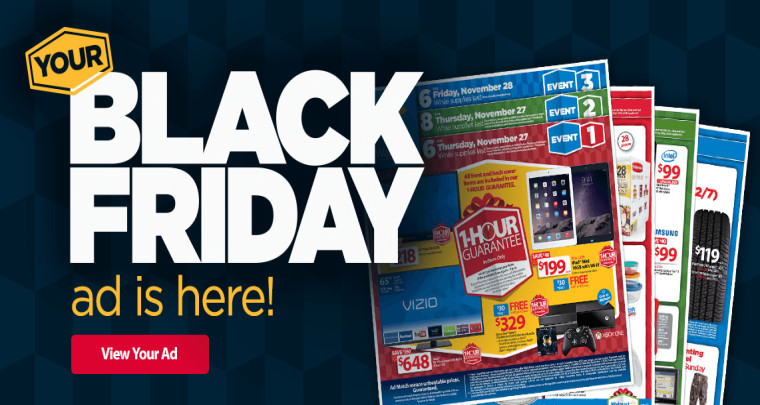
You are a GUI agent. You are given a task and a screenshot of the screen. Output one action in this format:
    pyautogui.click(x=<x>, y=<y>)
    Task: Click on the tv
    
    Given the screenshot: What is the action you would take?
    tap(437, 294)